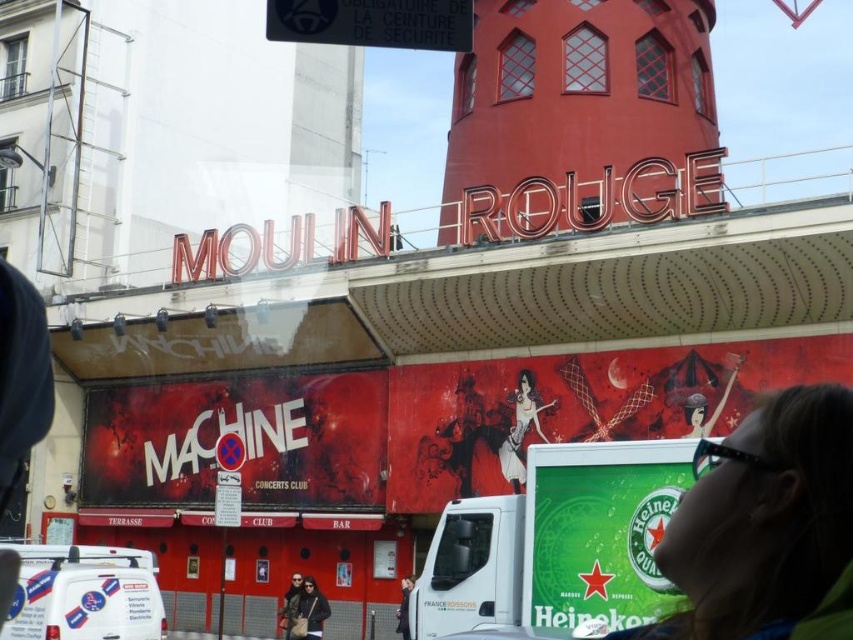
You are a photographer trying to capture the Moulin Rouge facade. You notice two elements in the scene that need to be framed properly. The green matte Heineken sign at lower right and the matte black jacket at lower center. Which of these two objects is wider?

The green matte Heineken sign at lower right is wider than the matte black jacket at lower center.

Looking at this image, you are standing in front of the Moulin Rouge and want to take a photo that includes both the matte red tower at upper center and the white plastic van at lower left. Which object should you focus on first to ensure both are in the frame?

You should focus on the matte red tower at upper center first because it is closer to you than the white plastic van at lower left, so adjusting the camera to include it will also capture the van in the background.

You are a delivery person trying to park your 2.5 meter tall delivery truck near the Moulin Rouge. You see a white plastic van at lower left and a matte black jacket at lower center. Which parking spot can accommodate your vehicle?

The white plastic van at lower left is much taller than the matte black jacket at lower center, so the parking spot near the white plastic van at lower left can accommodate your 2.5 meter tall delivery truck.